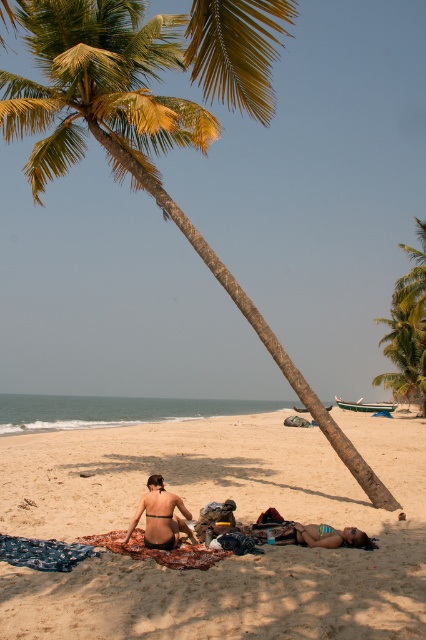
Question: From the image, what is the correct spatial relationship of beige sandy beach at center in relation to matte black bikini at center?

Choices:
 (A) below
 (B) above

Answer: (A)

Question: Is green leafy palm tree at right smaller than multicolored woven blanket at center?

Choices:
 (A) no
 (B) yes

Answer: (A)

Question: Which point is farther from the camera taking this photo?

Choices:
 (A) [x=152, y=490]
 (B) [x=46, y=593]

Answer: (A)

Question: Which of the following is the closest to the observer?

Choices:
 (A) bright pink bikini at center
 (B) matte black bikini at center
 (C) beige sandy beach at center
 (D) multicolored woven blanket at center

Answer: (C)

Question: From the image, what is the correct spatial relationship of beige sandy beach at center in relation to matte black bikini at center?

Choices:
 (A) left
 (B) right

Answer: (B)

Question: Among these points, which one is farthest from the camera?

Choices:
 (A) (187, 548)
 (B) (150, 528)

Answer: (A)